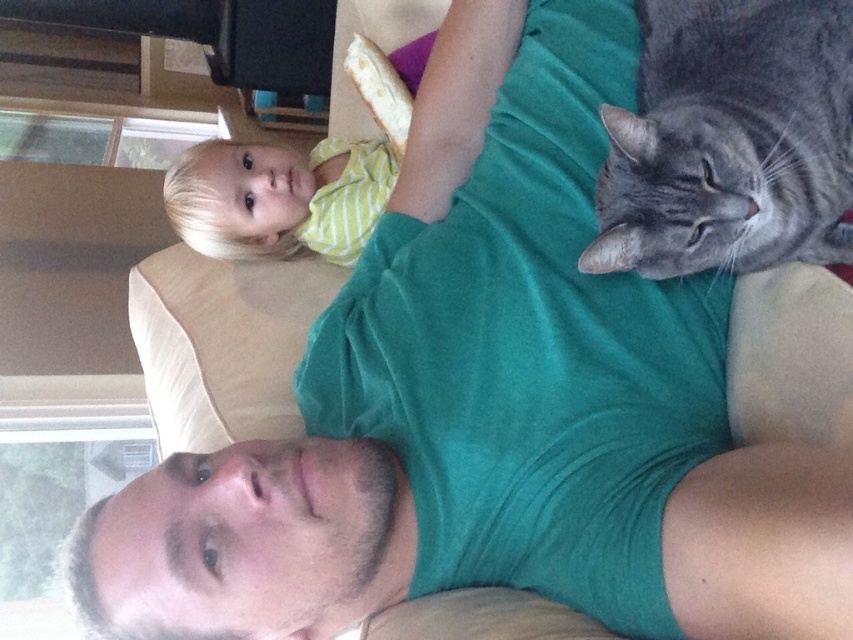
You are taking a photo of the gray tabby cat at upper right and the yellow striped shirt at upper left. Which one should you focus on if you want the one on the right side to be in focus?

You should focus on the gray tabby cat at upper right because it is positioned on the right side of the yellow striped shirt at upper left.

You are a photographer trying to capture a closeup shot of the gray tabby cat at upper right. You are currently positioned 40 inches away from the cat. Can you move closer to get a better shot without exceeding the minimum safe distance of 30 inches? Explain your reasoning.

The gray tabby cat at upper right is currently 35.03 inches away from the camera. Since the minimum safe distance is 30 inches, you can move closer by approximately 5 inches to get a better shot while staying within the safe range.